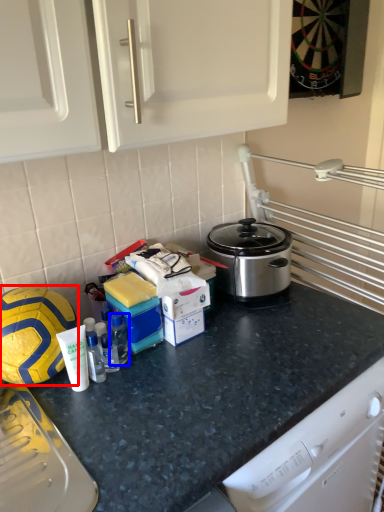
Question: Among these objects, which one is nearest to the camera, football (highlighted by a red box) or bottle (highlighted by a blue box)?

Choices:
 (A) football
 (B) bottle

Answer: (A)